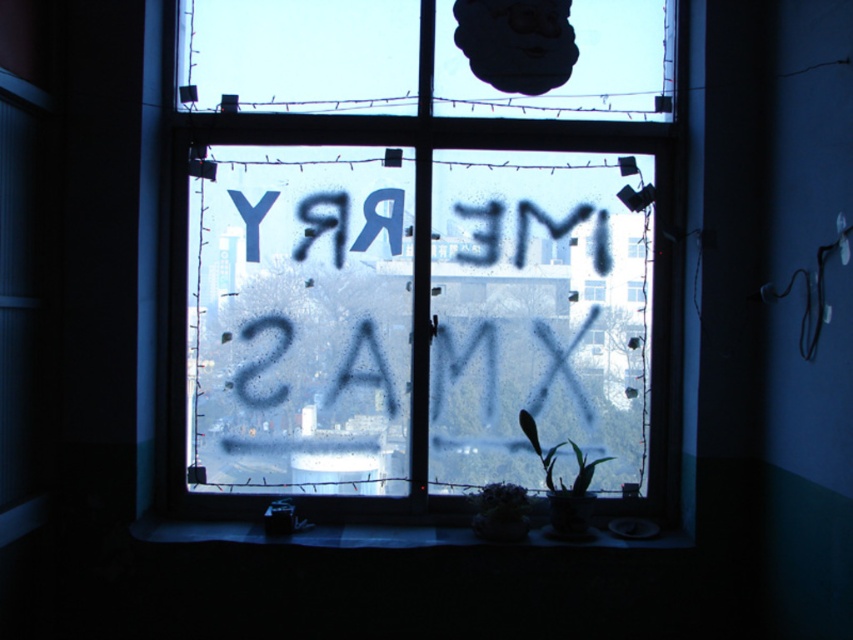
Question: Which object is the closest to the green leafy plant at center?

Choices:
 (A) smooth concrete surface at lower center
 (B) frosted glass window at center

Answer: (A)

Question: Based on their relative distances, which object is nearer to the green leafy plant at center?

Choices:
 (A) frosted glass window at center
 (B) smooth concrete surface at lower center

Answer: (B)

Question: Is frosted glass window at center wider than smooth concrete surface at lower center?

Choices:
 (A) yes
 (B) no

Answer: (B)

Question: Estimate the real-world distances between objects in this image. Which object is farther from the green leafy plant at center?

Choices:
 (A) smooth concrete surface at lower center
 (B) frosted glass window at center

Answer: (B)

Question: Is the position of frosted glass window at center more distant than that of green leafy plant at center?

Choices:
 (A) no
 (B) yes

Answer: (B)

Question: In this image, where is frosted glass window at center located relative to smooth concrete surface at lower center?

Choices:
 (A) above
 (B) below

Answer: (A)